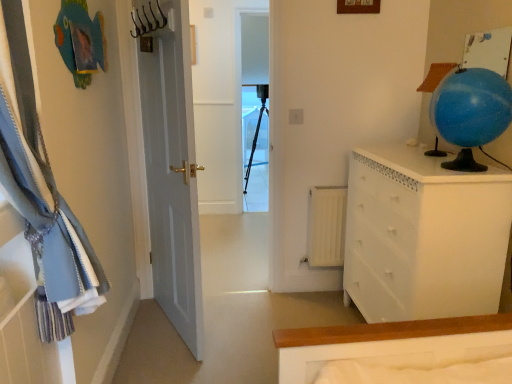
Question: Is white glossy chest of drawers at right to the right of transparent plastic screen door at center from the viewer's perspective?

Choices:
 (A) no
 (B) yes

Answer: (B)

Question: Would you say white glossy chest of drawers at right contains transparent plastic screen door at center?

Choices:
 (A) no
 (B) yes

Answer: (A)

Question: Can you confirm if white glossy chest of drawers at right is wider than transparent plastic screen door at center?

Choices:
 (A) no
 (B) yes

Answer: (B)

Question: Is white glossy chest of drawers at right next to transparent plastic screen door at center?

Choices:
 (A) yes
 (B) no

Answer: (B)

Question: From a real-world perspective, is white glossy chest of drawers at right physically below transparent plastic screen door at center?

Choices:
 (A) yes
 (B) no

Answer: (A)

Question: Does white glossy chest of drawers at right have a larger size compared to transparent plastic screen door at center?

Choices:
 (A) no
 (B) yes

Answer: (B)

Question: Does transparent plastic screen door at center have a lesser width compared to blue glossy globe at upper right?

Choices:
 (A) yes
 (B) no

Answer: (A)

Question: Is transparent plastic screen door at center to the right of blue glossy globe at upper right from the viewer's perspective?

Choices:
 (A) no
 (B) yes

Answer: (A)

Question: Is transparent plastic screen door at center surrounding blue glossy globe at upper right?

Choices:
 (A) no
 (B) yes

Answer: (A)

Question: From the image's perspective, would you say transparent plastic screen door at center is shown under blue glossy globe at upper right?

Choices:
 (A) yes
 (B) no

Answer: (B)

Question: Is transparent plastic screen door at center wider than blue glossy globe at upper right?

Choices:
 (A) no
 (B) yes

Answer: (A)

Question: Is transparent plastic screen door at center further to the viewer compared to blue glossy globe at upper right?

Choices:
 (A) no
 (B) yes

Answer: (B)

Question: Can we say white glossy chest of drawers at right lies outside metallic hook at upper center?

Choices:
 (A) no
 (B) yes

Answer: (B)